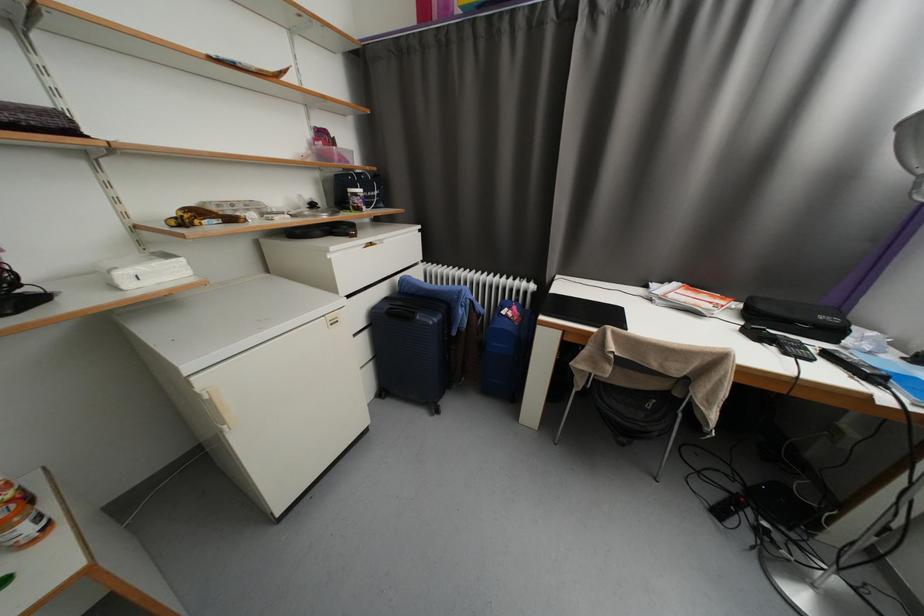
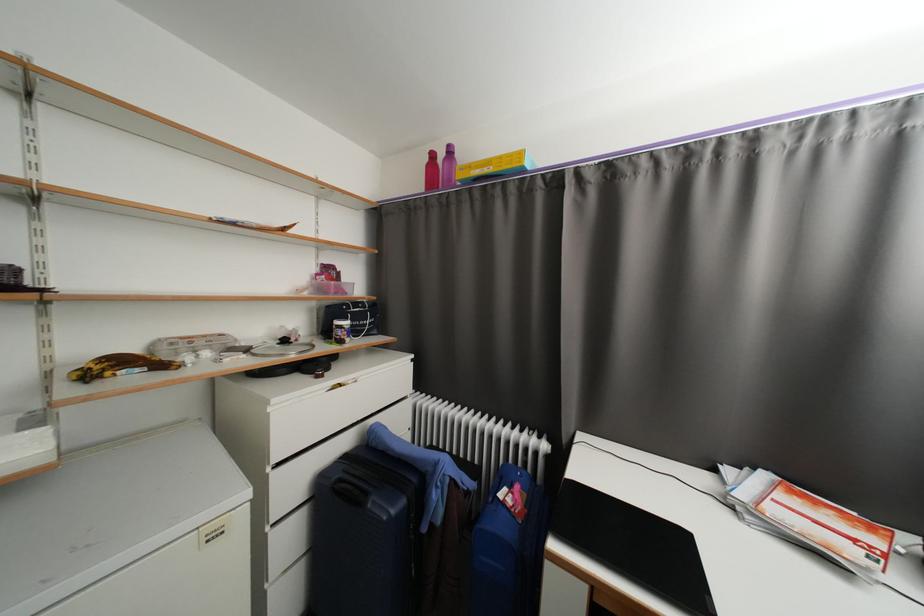
Locate, in the second image, the point that corresponds to (396,310) in the first image.

(346, 482)